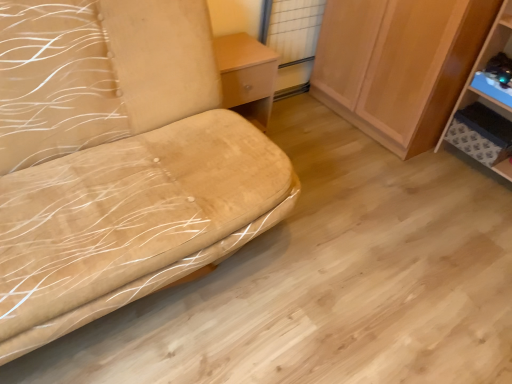
I want to click on free space above light wood/texture table at center (from a real-world perspective), so click(x=234, y=51).